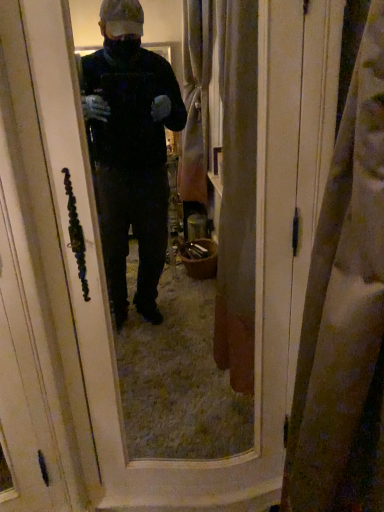
Find the location of a particular element. Image resolution: width=384 pixels, height=512 pixels. dark matte trench coat at right is located at coordinates (345, 314).

The width and height of the screenshot is (384, 512). What do you see at coordinates (345, 314) in the screenshot? I see `dark matte trench coat at right` at bounding box center [345, 314].

What is the approximate height of dark matte trench coat at right?

dark matte trench coat at right is 1.03 meters tall.

The image size is (384, 512). I want to click on dark matte trench coat at right, so click(345, 314).